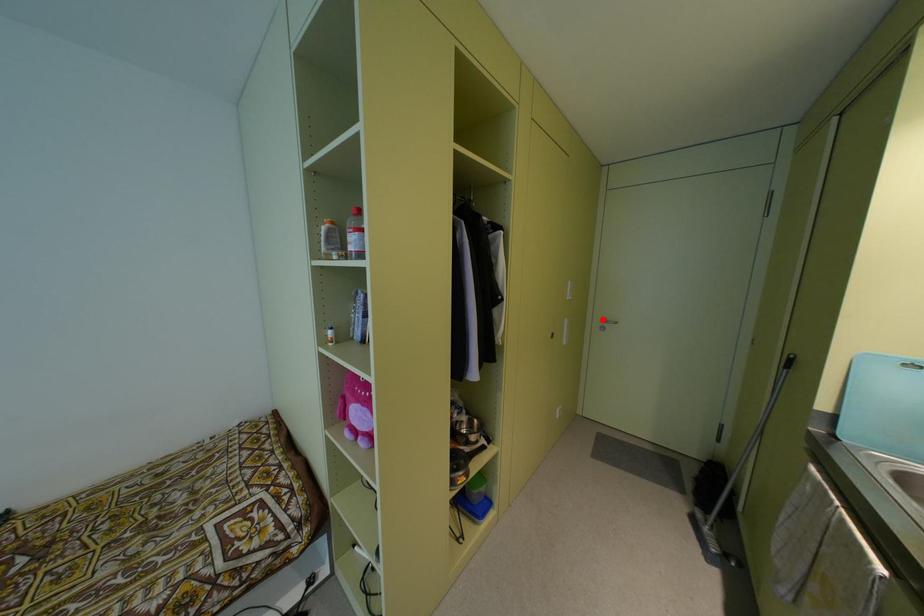
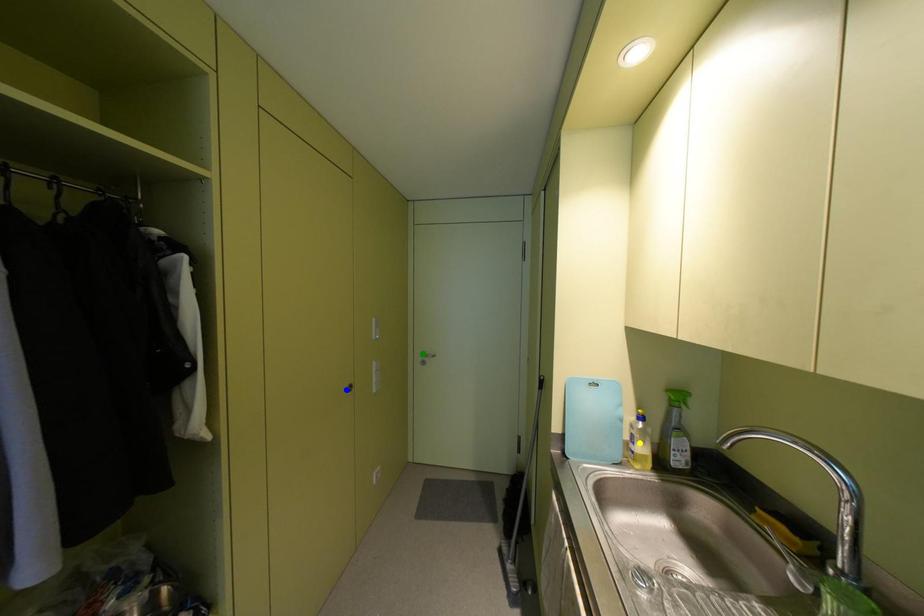
Question: I am providing you with two images of the same scene from different viewpoints. A red point is marked on the first image. You are given multiple points on the second image. Which point in image 2 is actually the same real-world point as the red point in image 1?

Choices:
 (A) green point
 (B) yellow point
 (C) blue point

Answer: (A)